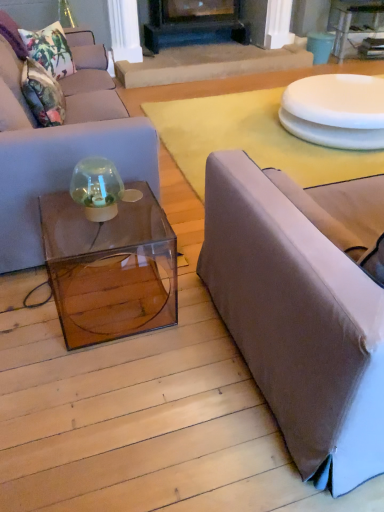
Question: Is matte gray couch at left, positioned as the 1th studio couch in left-to-right order, oriented towards black matte fireplace at center?

Choices:
 (A) yes
 (B) no

Answer: (B)

Question: Is matte gray couch at left, positioned as the 1th studio couch in left-to-right order, smaller than black matte fireplace at center?

Choices:
 (A) no
 (B) yes

Answer: (A)

Question: Can you confirm if matte gray couch at left, which is the second studio couch from right to left, is shorter than black matte fireplace at center?

Choices:
 (A) yes
 (B) no

Answer: (B)

Question: Is matte gray couch at left, positioned as the 1th studio couch in left-to-right order, to the right of black matte fireplace at center from the viewer's perspective?

Choices:
 (A) no
 (B) yes

Answer: (A)

Question: Is matte gray couch at left, positioned as the 1th studio couch in left-to-right order, thinner than black matte fireplace at center?

Choices:
 (A) yes
 (B) no

Answer: (B)

Question: Visually, is white glossy plate at upper right positioned to the left or to the right of white glossy plate at upper right?

Choices:
 (A) left
 (B) right

Answer: (A)

Question: Considering the positions of white glossy plate at upper right and white glossy plate at upper right in the image, is white glossy plate at upper right bigger or smaller than white glossy plate at upper right?

Choices:
 (A) small
 (B) big

Answer: (A)

Question: Is white glossy plate at upper right in front of or behind white glossy plate at upper right in the image?

Choices:
 (A) behind
 (B) front

Answer: (B)

Question: From their relative heights in the image, would you say white glossy plate at upper right is taller or shorter than white glossy plate at upper right?

Choices:
 (A) short
 (B) tall

Answer: (A)

Question: Looking at the image, does transparent acrylic cube at center seem bigger or smaller compared to floral fabric pillow at upper left, positioned as the 2th pillow in bottom-to-top order?

Choices:
 (A) small
 (B) big

Answer: (B)

Question: Is transparent acrylic cube at center wider or thinner than floral fabric pillow at upper left, which is the first pillow from top to bottom?

Choices:
 (A) wide
 (B) thin

Answer: (A)

Question: Considering their positions, is transparent acrylic cube at center located in front of or behind floral fabric pillow at upper left, which is the first pillow from top to bottom?

Choices:
 (A) front
 (B) behind

Answer: (A)

Question: From a real-world perspective, is transparent acrylic cube at center physically located above or below floral fabric pillow at upper left, positioned as the 2th pillow in bottom-to-top order?

Choices:
 (A) below
 (B) above

Answer: (A)

Question: Is transparent glass table at upper right spatially inside matte gray couch at left, positioned as the 1th studio couch in left-to-right order, or outside of it?

Choices:
 (A) outside
 (B) inside

Answer: (A)

Question: Considering their positions, is transparent glass table at upper right located in front of or behind matte gray couch at left, positioned as the 1th studio couch in left-to-right order?

Choices:
 (A) front
 (B) behind

Answer: (B)